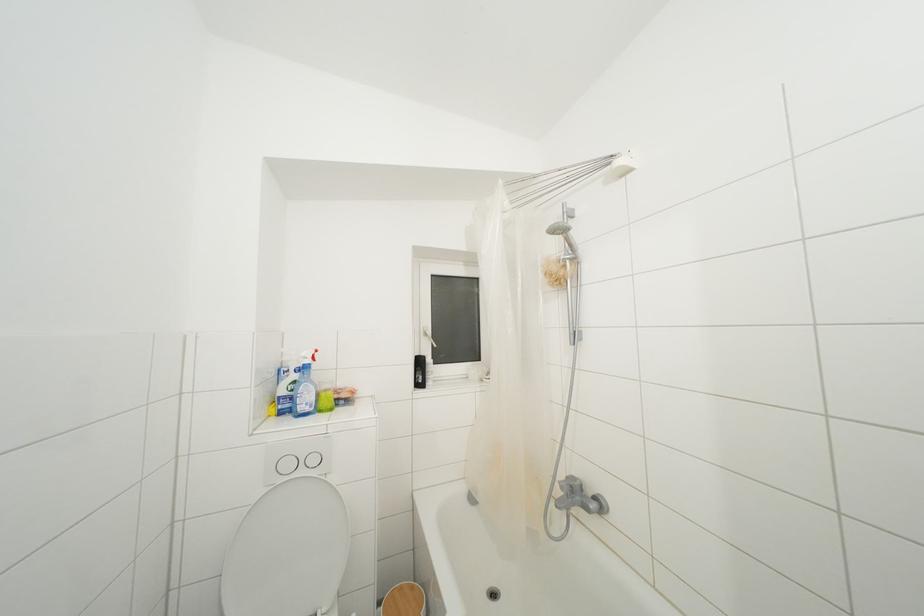
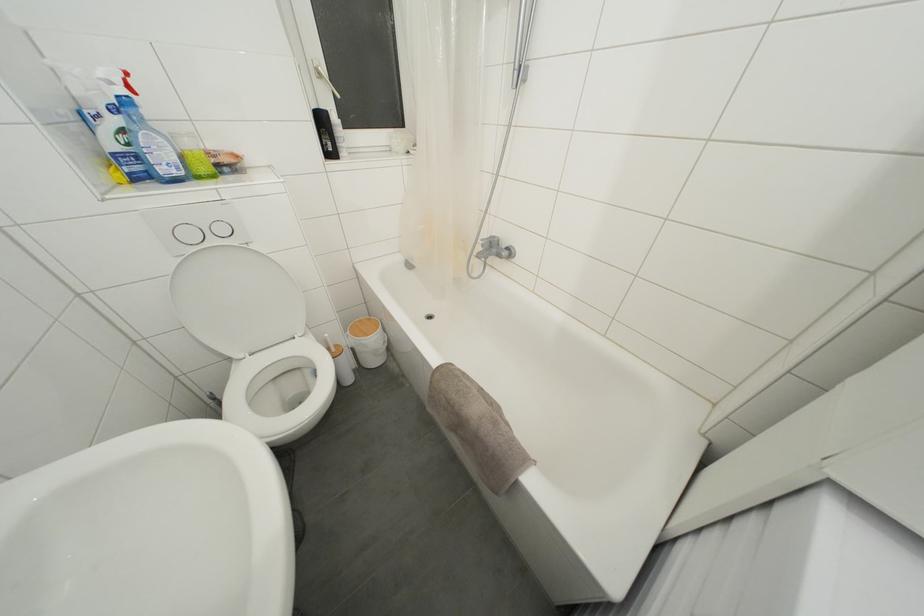
Question: I am providing you with two images of the same scene from different viewpoints. Please identify which objects are invisible in image2.

Choices:
 (A) black bottle
 (B) green sponge
 (C) toilet flush button
 (D) none of these

Answer: (D)